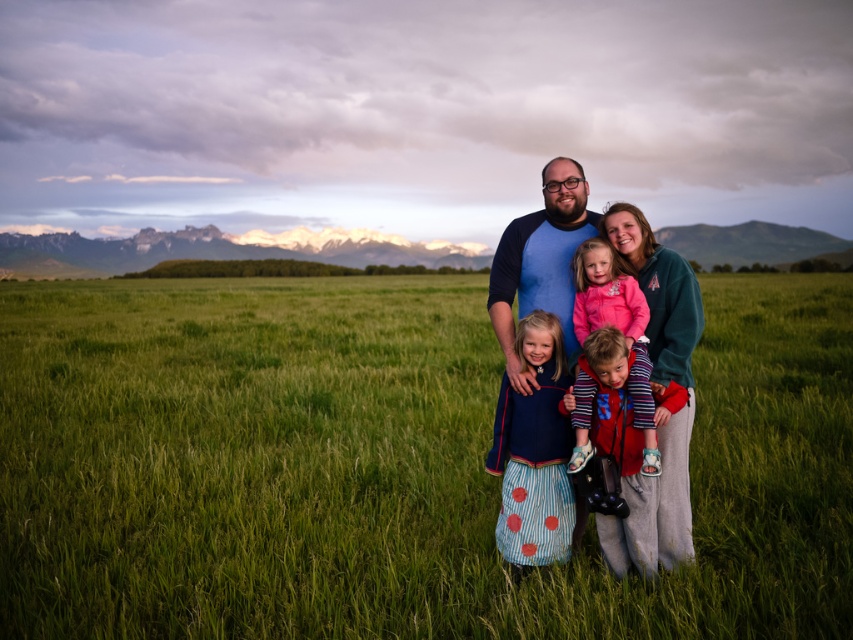
Does blue cotton shirt at center have a smaller size compared to blue polka dot dress at center?

No, blue cotton shirt at center is not smaller than blue polka dot dress at center.

Which is behind, point (679, 378) or point (537, 428)?

The point (537, 428) is more distant.

This screenshot has height=640, width=853. In order to click on blue cotton shirt at center in this screenshot , I will do `click(540, 262)`.

Which of these two, blue jersey at center or pink fleece jacket at center, stands taller?

blue jersey at center is taller.

Who is more distant from viewer, (543, 182) or (625, 282)?

The point (543, 182) is more distant.

Does point (575, 166) lie in front of point (646, 374)?

No, (575, 166) is further to viewer.

This screenshot has height=640, width=853. In order to click on blue jersey at center in this screenshot , I will do `click(540, 260)`.

Can you confirm if blue polka dot dress at center is taller than pink fleece jacket at center?

Yes, blue polka dot dress at center is taller than pink fleece jacket at center.

Can you confirm if blue polka dot dress at center is thinner than pink fleece jacket at center?

Incorrect, blue polka dot dress at center's width is not less than pink fleece jacket at center's.

Measure the distance between point (515, 417) and camera.

A distance of 5.16 meters exists between point (515, 417) and camera.

This screenshot has height=640, width=853. I want to click on blue polka dot dress at center, so click(534, 451).